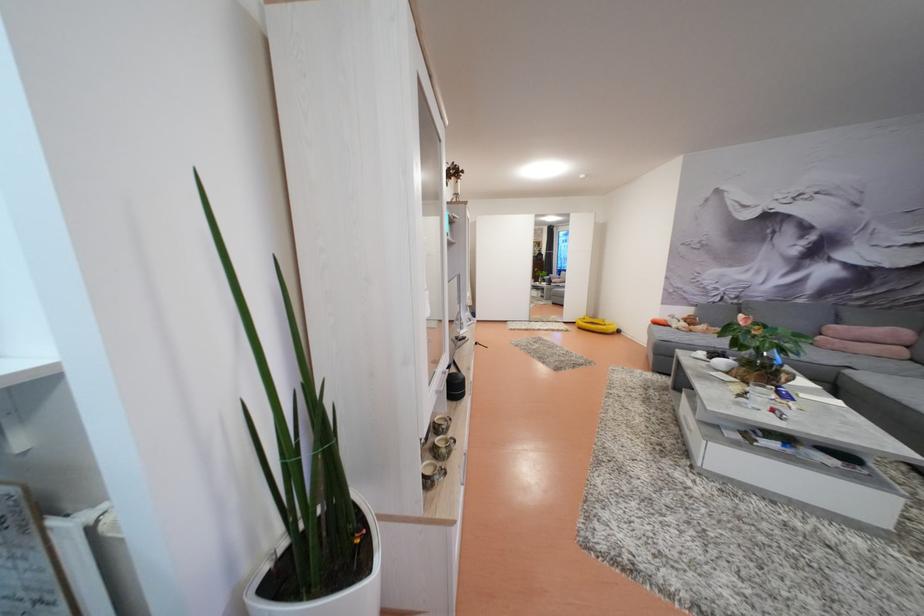
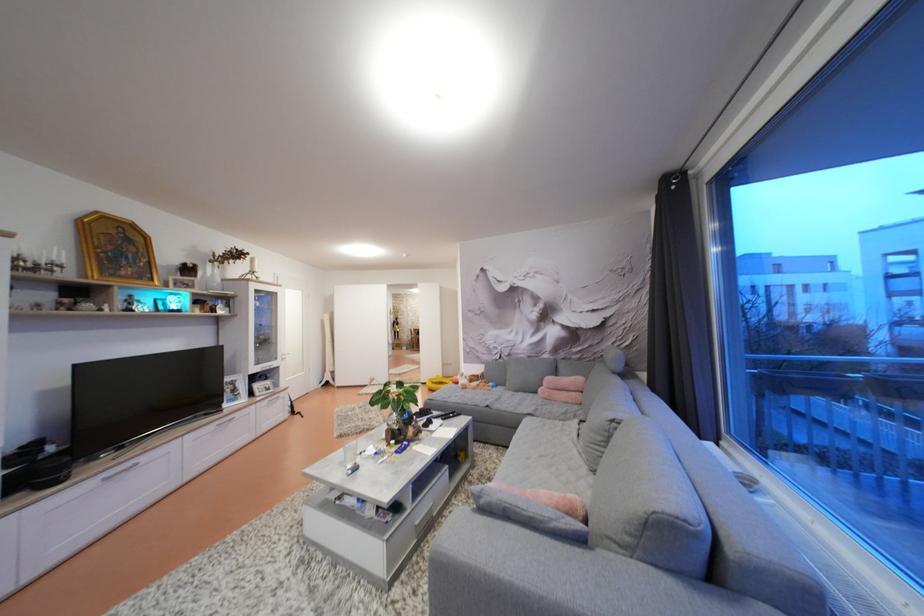
In the second image, find the point that corresponds to point 841,333 in the first image.

(556, 384)